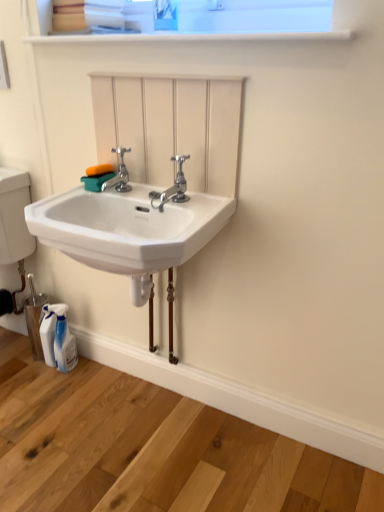
Question: Is polished chrome faucet at center, the 2th tap from the left, to the left or to the right of white glossy shelf at upper center in the image?

Choices:
 (A) left
 (B) right

Answer: (A)

Question: In terms of height, does polished chrome faucet at center, which is the first tap from right to left, look taller or shorter compared to white glossy shelf at upper center?

Choices:
 (A) tall
 (B) short

Answer: (A)

Question: Which object is positioned farthest from the polished chrome faucet at center, the 2th tap from the left?

Choices:
 (A) white glossy shelf at upper center
 (B) chrome metallic faucet at center, acting as the first tap starting from the left
 (C) white glossy spray bottle at lower left
 (D) white ceramic sink at center

Answer: (C)

Question: Estimate the real-world distances between objects in this image. Which object is farther from the white glossy shelf at upper center?

Choices:
 (A) white glossy spray bottle at lower left
 (B) polished chrome faucet at center, the 2th tap from the left
 (C) white ceramic sink at center
 (D) chrome metallic faucet at center, acting as the first tap starting from the left

Answer: (A)